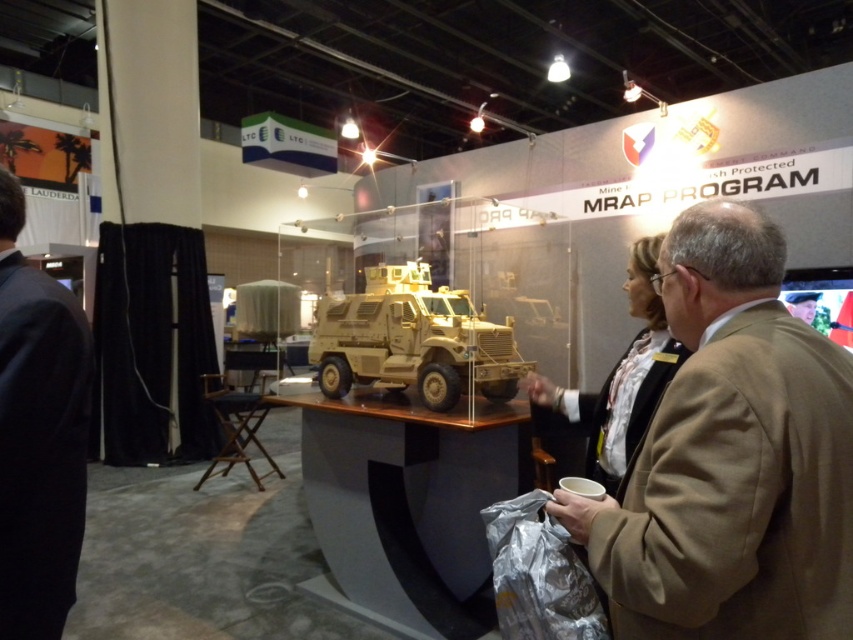
Between tan fabric suit at right and black suit at left, which one appears on the right side from the viewer's perspective?

tan fabric suit at right is more to the right.

Measure the distance between tan fabric suit at right and camera.

tan fabric suit at right and camera are 85.00 centimeters apart.

Is point (631, 502) less distant than point (74, 332)?

Yes, it is.

The image size is (853, 640). I want to click on tan fabric suit at right, so point(730,458).

Which is below, tan fabric suit at right or tan matte mrap at center?

tan fabric suit at right

Is tan fabric suit at right positioned behind tan matte mrap at center?

No, it is in front of tan matte mrap at center.

Is point (772, 573) farther from viewer compared to point (471, 305)?

No.

The width and height of the screenshot is (853, 640). What are the coordinates of `tan fabric suit at right` in the screenshot? It's located at (730, 458).

From the picture: Is black suit at left above tan matte mrap at center?

No, black suit at left is not above tan matte mrap at center.

Does black suit at left appear on the left side of tan matte mrap at center?

Yes, black suit at left is to the left of tan matte mrap at center.

Is point (4, 465) positioned behind point (392, 285)?

No, it is in front of (392, 285).

Locate an element on the screen. The height and width of the screenshot is (640, 853). black suit at left is located at coordinates (38, 435).